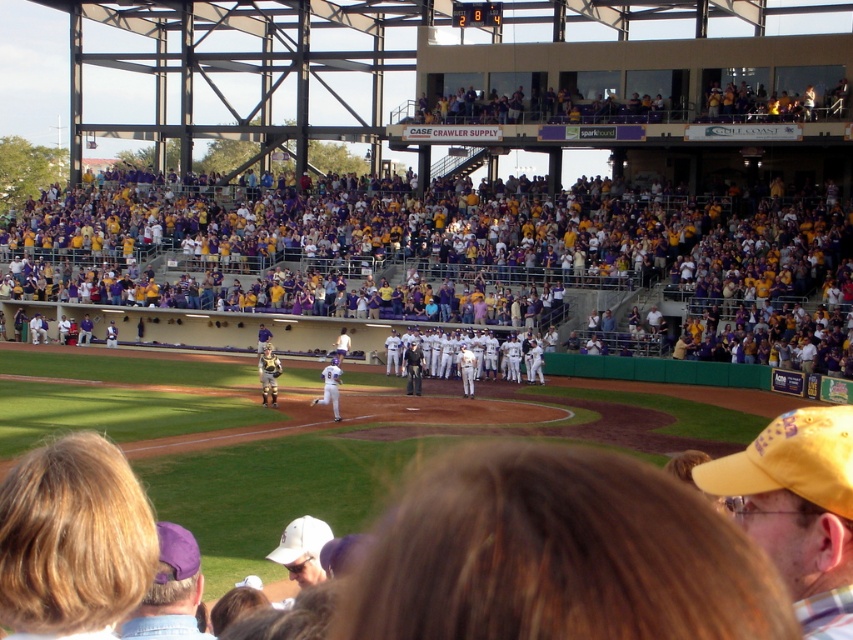
Question: Can you confirm if white uniformed players at center is wider than gold metallic helmet at center?

Choices:
 (A) no
 (B) yes

Answer: (B)

Question: Which of the following is the farthest from the observer?

Choices:
 (A) (471, 396)
 (B) (408, 344)
 (C) (381, 294)

Answer: (C)

Question: Can you confirm if white uniformed players at center is positioned to the right of white matte baseball cap at lower center?

Choices:
 (A) yes
 (B) no

Answer: (A)

Question: Among these objects, which one is nearest to the camera?

Choices:
 (A) white matte baseball cap at lower center
 (B) yellow fabric cap at upper right
 (C) purple/yellow jersey at upper center
 (D) white uniformed players at center

Answer: (B)

Question: Which object is the closest to the white matte baseball cap at lower center?

Choices:
 (A) purple fabric cap at lower left
 (B) white uniformed players at center
 (C) white matte baseball player at center

Answer: (A)

Question: Is purple/yellow jersey at upper center to the right of purple fabric cap at lower left from the viewer's perspective?

Choices:
 (A) no
 (B) yes

Answer: (A)